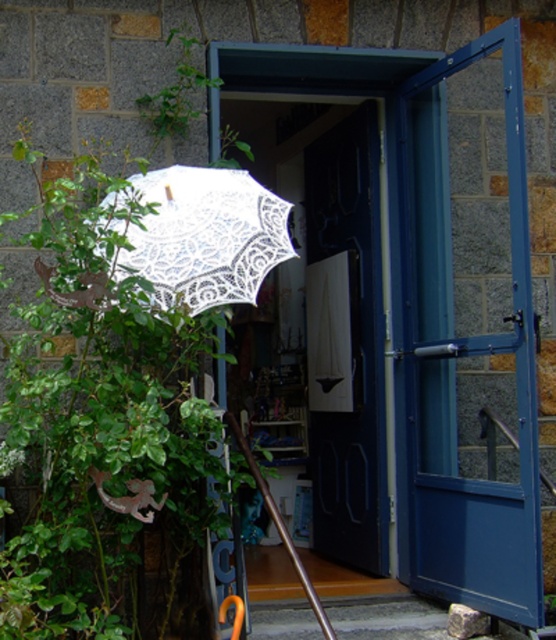
Question: Can you confirm if blue glass door at right is positioned to the left of white lace umbrella at left?

Choices:
 (A) yes
 (B) no

Answer: (B)

Question: Is blue glass door at right below white lace umbrella at left?

Choices:
 (A) yes
 (B) no

Answer: (A)

Question: Which point is closer to the camera?

Choices:
 (A) (433, 568)
 (B) (259, 227)

Answer: (B)

Question: Is blue glass door at right below white lace umbrella at left?

Choices:
 (A) yes
 (B) no

Answer: (A)

Question: Which object is closer to the camera taking this photo?

Choices:
 (A) blue glass door at right
 (B) white lace umbrella at left

Answer: (B)